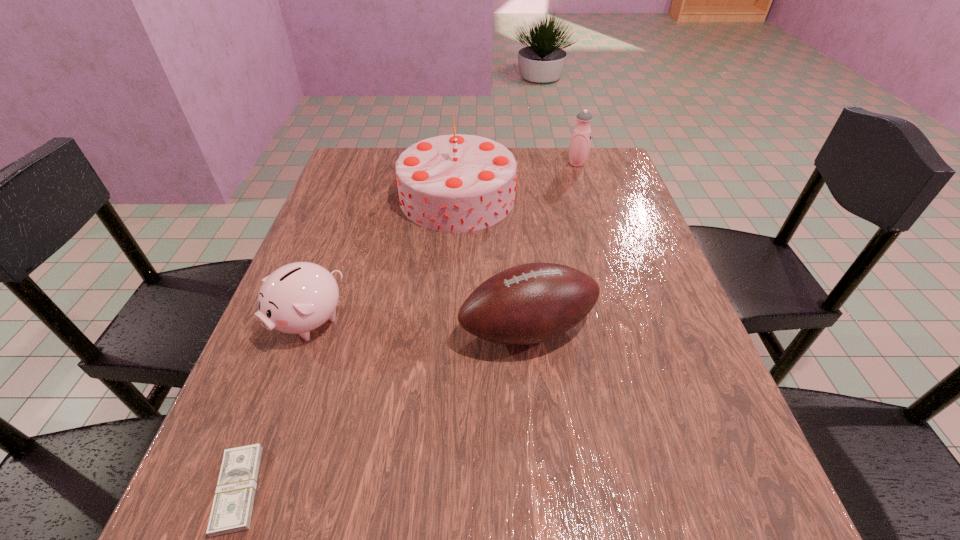
The width and height of the screenshot is (960, 540). In order to click on free spot at the near edge of the desktop in this screenshot , I will do `click(345, 501)`.

Locate an element on the screen. The image size is (960, 540). free region at the left edge of the desktop is located at coordinates (260, 388).

The image size is (960, 540). What are the coordinates of `blank space at the right edge of the desktop` in the screenshot? It's located at (631, 413).

In the image, there is a desktop. At what (x,y) coordinates should I click in order to perform the action: click on vacant space at the far right corner. Please return your answer as a coordinate pair (x, y). The image size is (960, 540). Looking at the image, I should click on (621, 174).

In the image, there is a desktop. At what (x,y) coordinates should I click in order to perform the action: click on free space at the near right corner. Please return your answer as a coordinate pair (x, y). The image size is (960, 540). Looking at the image, I should click on (754, 510).

This screenshot has height=540, width=960. I want to click on blank region between the football (American) and the nearest object, so click(383, 409).

Where is `unoccupied position between the piggy bank and the nearest object`? This screenshot has width=960, height=540. unoccupied position between the piggy bank and the nearest object is located at coordinates (274, 406).

Find the location of a particular element. Image resolution: width=960 pixels, height=540 pixels. free point between the money and the rightmost object is located at coordinates (408, 327).

The width and height of the screenshot is (960, 540). Find the location of `empty space between the rightmost object and the birthday cake`. empty space between the rightmost object and the birthday cake is located at coordinates (517, 180).

Find the location of `empty space between the thermos bottle and the tallest object`. empty space between the thermos bottle and the tallest object is located at coordinates (517, 180).